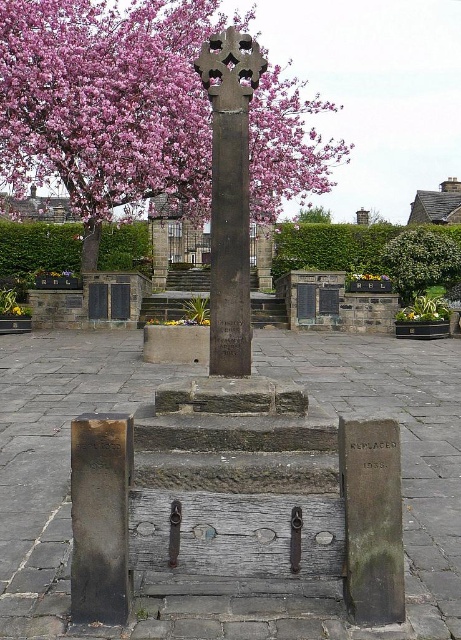
Question: Estimate the real-world distances between objects in this image. Which object is farther from the pink blossoms at upper left?

Choices:
 (A) green leafy tree at center
 (B) pink blossom tree at upper center
 (C) dark gray stone cross at center

Answer: (B)

Question: Is pink blossoms at upper left thinner than pink blossom tree at upper center?

Choices:
 (A) yes
 (B) no

Answer: (B)

Question: Is dark gray stone cross at center below pink blossoms at upper left?

Choices:
 (A) no
 (B) yes

Answer: (B)

Question: Which object is the farthest from the yellow fabric flower at center?

Choices:
 (A) green leafy plant at center
 (B) green leafy tree at center

Answer: (B)

Question: Based on their relative distances, which object is farther from the green leafy plant at center?

Choices:
 (A) pink blossom tree at upper center
 (B) green leafy tree at center
 (C) dark gray stone cross at center

Answer: (C)

Question: Is yellow fabric flower at center wider than green leafy plant at center?

Choices:
 (A) no
 (B) yes

Answer: (B)